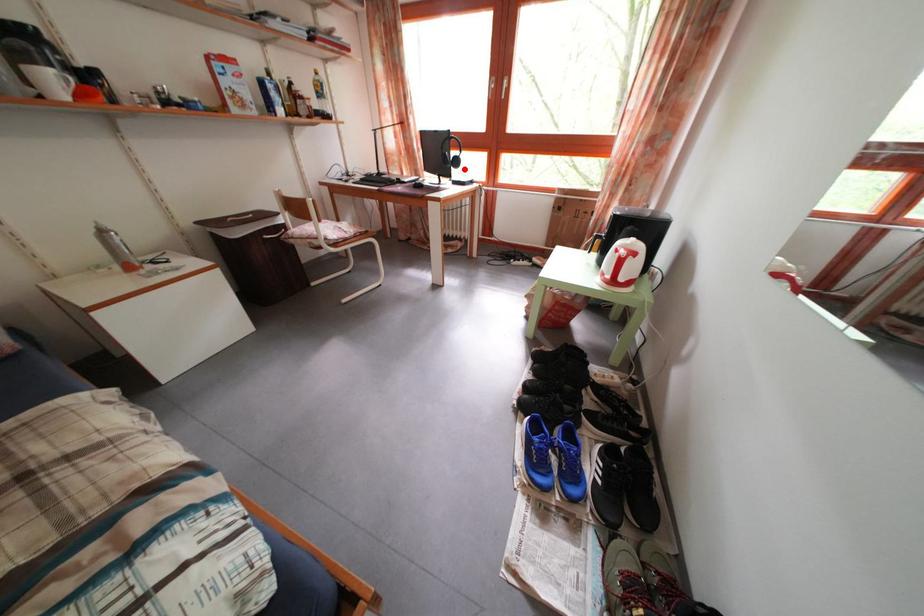
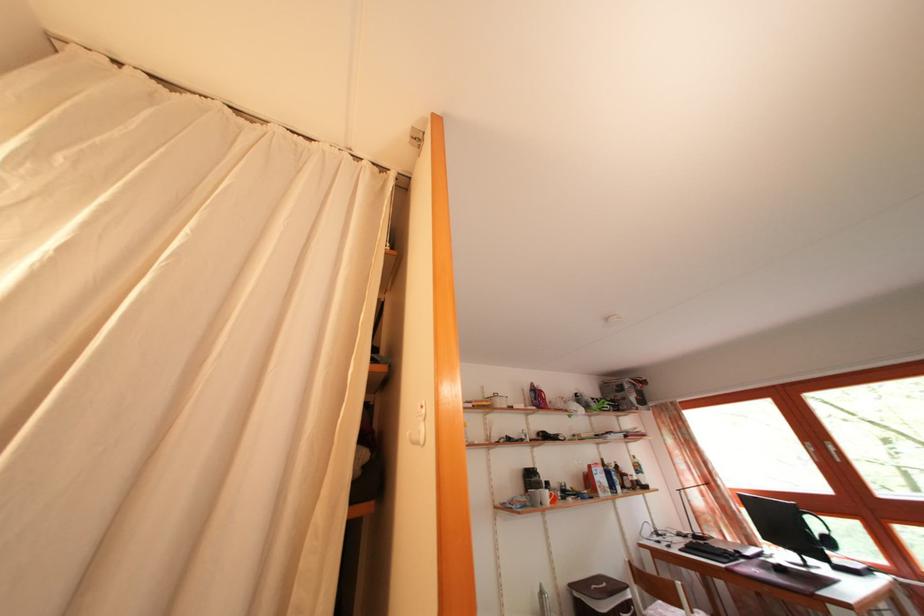
Question: A red point is marked in image1. In image2, is the corresponding 3D point closer to the camera or farther? Reply with the corresponding letter.

Choices:
 (A) The corresponding 3D point is closer.
 (B) The corresponding 3D point is farther.

Answer: (A)